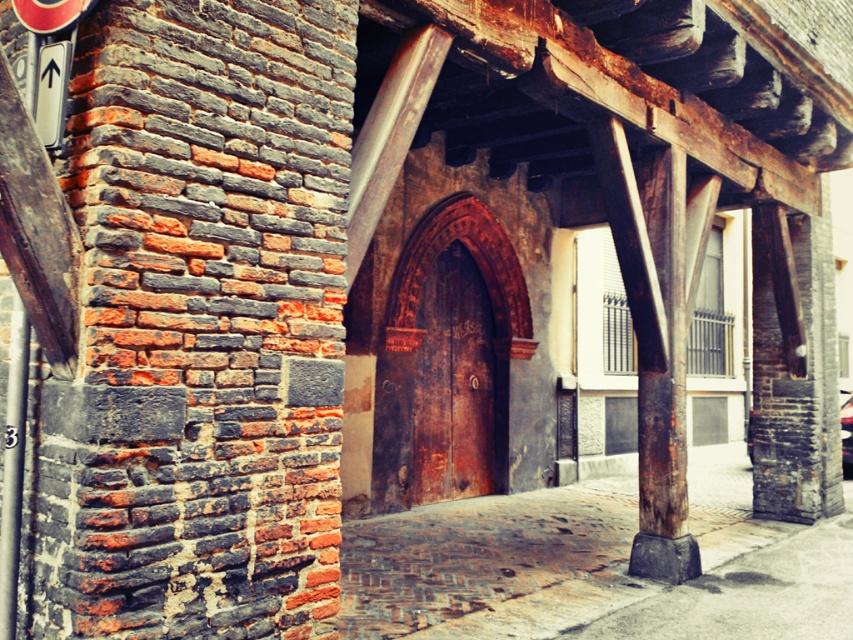
You are standing in front of the historic building and notice two points marked on the wall. The first point is at coordinates point (3, 584) and the second is at point (845, 470). Which point is closer to you?

Point (3, 584) is in front of point (845, 470), so it is closer to you.

You are standing in front of the historic building and notice two points marked on the structure. The first point is at coordinates point (x=33, y=112) and the second is at point (x=845, y=472). Which of these points is nearer to your current position?

Point (x=33, y=112) is closer to the camera than point (x=845, y=472), so the first point is nearer to your current position.